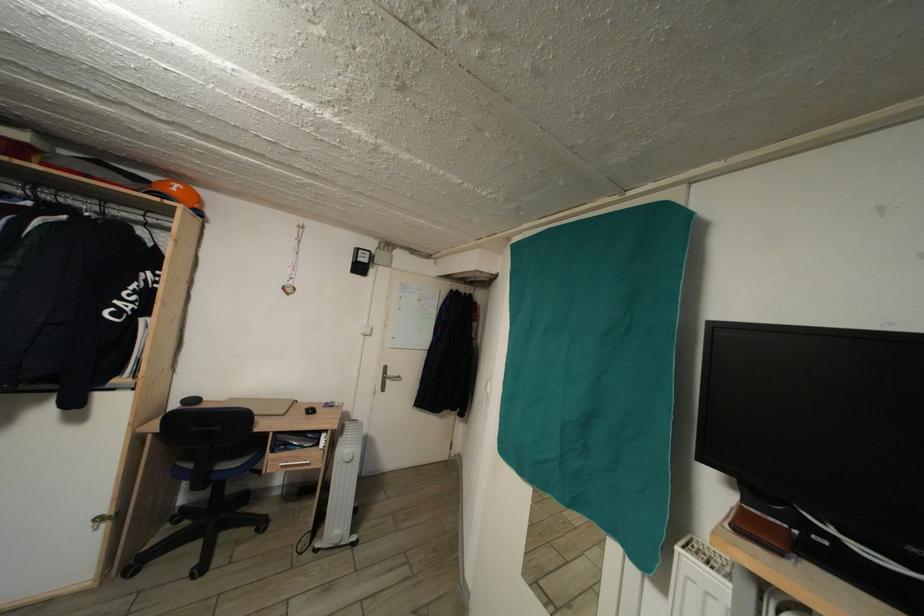
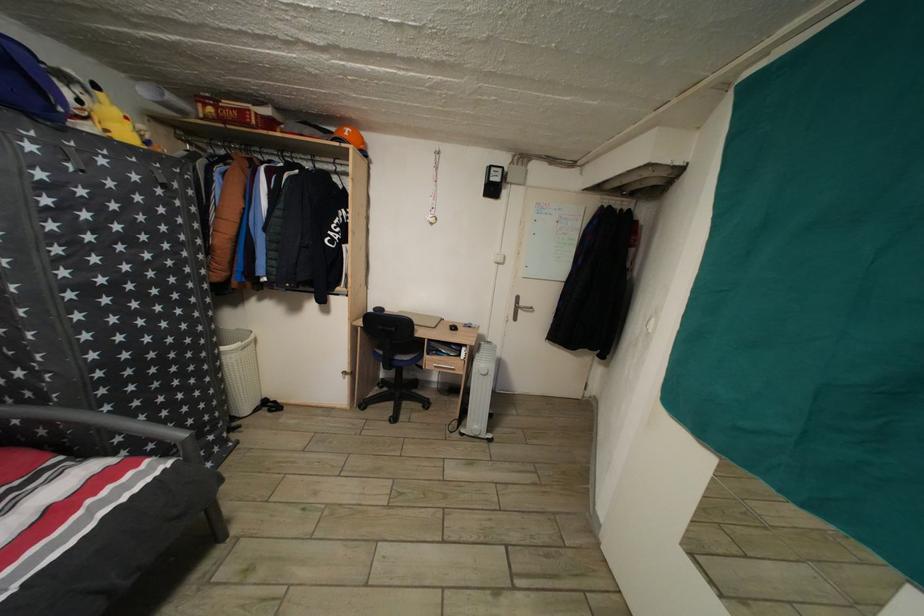
Where in the second image is the point corresponding to (396,379) from the first image?

(529, 310)